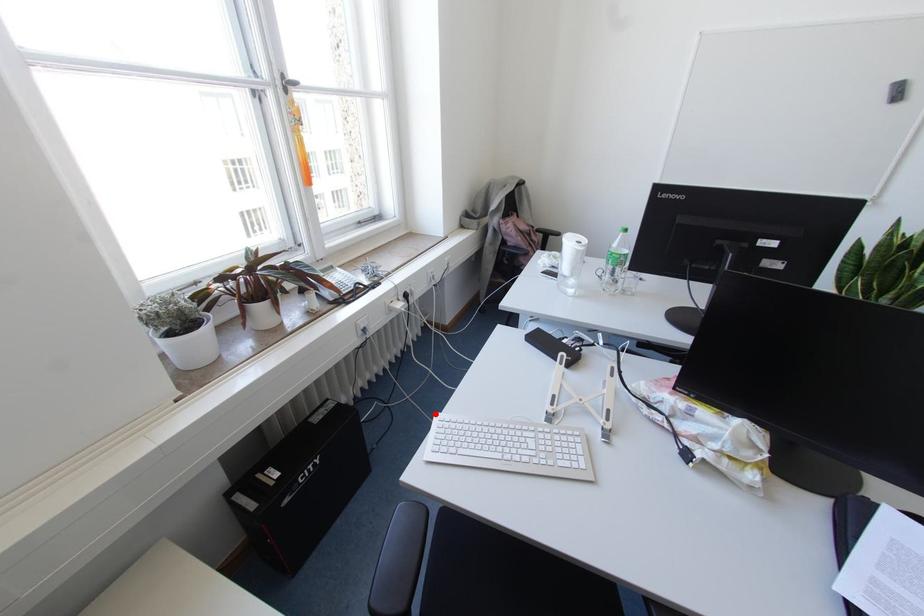
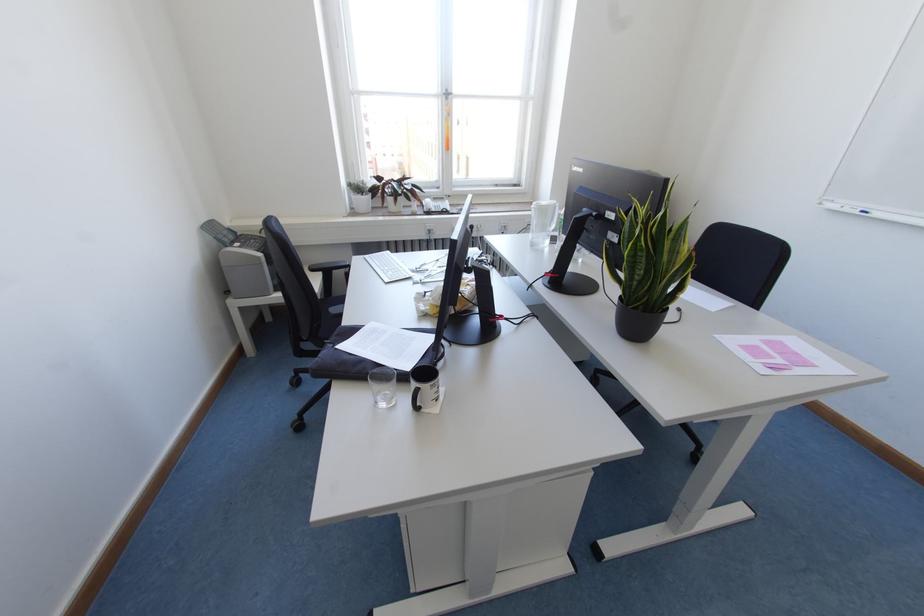
Find the pixel in the second image that matches the highlighted location in the first image.

(387, 251)